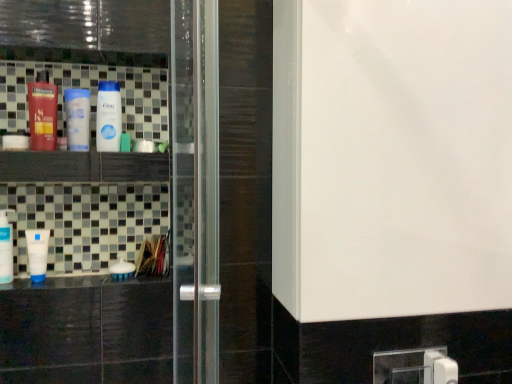
Question: Can you confirm if transparent glass screen door at center is shorter than white matte bottle at center, positioned as the 6th bottle in left-to-right order?

Choices:
 (A) yes
 (B) no

Answer: (B)

Question: Does transparent glass screen door at center have a smaller size compared to white matte bottle at center, positioned as the 1th bottle in right-to-left order?

Choices:
 (A) yes
 (B) no

Answer: (B)

Question: Is the depth of transparent glass screen door at center greater than that of white matte bottle at center, positioned as the 1th bottle in right-to-left order?

Choices:
 (A) no
 (B) yes

Answer: (A)

Question: Is transparent glass screen door at center completely or partially outside of white matte bottle at center, positioned as the 1th bottle in right-to-left order?

Choices:
 (A) no
 (B) yes

Answer: (B)

Question: Are transparent glass screen door at center and white matte bottle at center, positioned as the 6th bottle in left-to-right order, far apart?

Choices:
 (A) no
 (B) yes

Answer: (A)

Question: In the image, is matte black bottle at left, which is the fourth bottle from right to left, positioned in front of or behind white glossy counter top at lower left?

Choices:
 (A) front
 (B) behind

Answer: (B)

Question: Looking at the image, does matte black bottle at left, positioned as the third bottle in left-to-right order, seem bigger or smaller compared to white glossy counter top at lower left?

Choices:
 (A) small
 (B) big

Answer: (A)

Question: From a real-world perspective, is matte black bottle at left, which is the fourth bottle from right to left, above or below white glossy counter top at lower left?

Choices:
 (A) above
 (B) below

Answer: (A)

Question: From the image's perspective, is matte black bottle at left, positioned as the third bottle in left-to-right order, positioned above or below white glossy counter top at lower left?

Choices:
 (A) below
 (B) above

Answer: (B)

Question: Is white glossy bottle at center, which is the 2th bottle from right to left, bigger or smaller than white matte tube at lower left, placed as the second bottle when sorted from left to right?

Choices:
 (A) small
 (B) big

Answer: (B)

Question: From the image's perspective, relative to white matte tube at lower left, placed as the second bottle when sorted from left to right, is white glossy bottle at center, which is counted as the 5th bottle, starting from the left, above or below?

Choices:
 (A) above
 (B) below

Answer: (A)

Question: Is white glossy bottle at center, which is the 2th bottle from right to left, taller or shorter than white matte tube at lower left, which ranks as the fifth bottle in right-to-left order?

Choices:
 (A) tall
 (B) short

Answer: (A)

Question: Choose the correct answer: Is white glossy bottle at center, which is the 2th bottle from right to left, inside white matte tube at lower left, which ranks as the fifth bottle in right-to-left order, or outside it?

Choices:
 (A) inside
 (B) outside

Answer: (B)

Question: Is point (37, 132) closer or farther from the camera than point (35, 236)?

Choices:
 (A) farther
 (B) closer

Answer: (B)

Question: From a real-world perspective, relative to white matte tube at lower left, which ranks as the fifth bottle in right-to-left order, is matte black bottle at left, which is the fourth bottle from right to left, vertically above or below?

Choices:
 (A) above
 (B) below

Answer: (A)